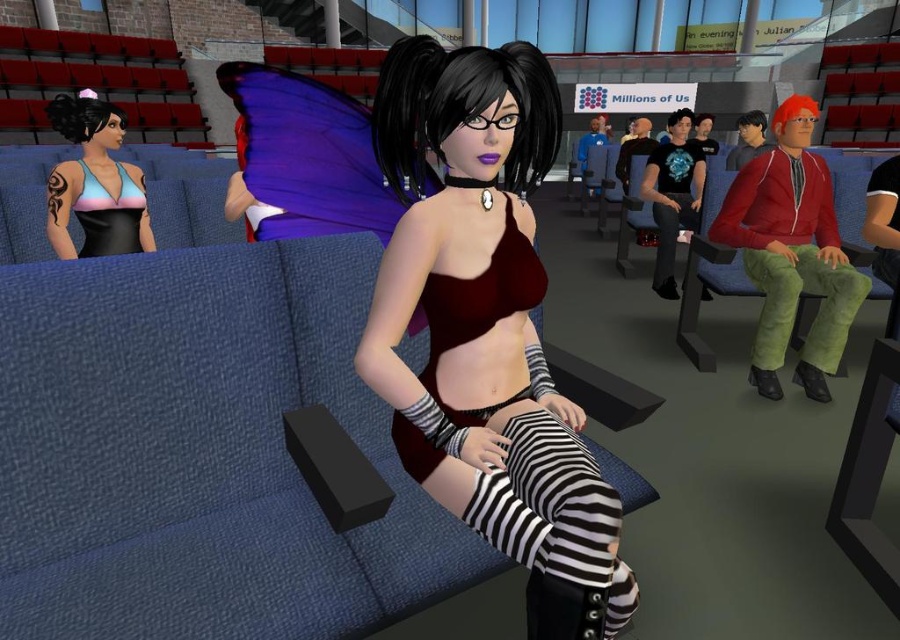
Question: Which of the following is the farthest from the observer?

Choices:
 (A) (657, 268)
 (B) (523, 268)
 (C) (774, 355)

Answer: (A)

Question: Is satin burgundy dress at center closer to camera compared to matte black bikini top at left?

Choices:
 (A) no
 (B) yes

Answer: (B)

Question: Can you confirm if matte black bikini top at left is positioned to the left of green fuzzy pants at right?

Choices:
 (A) yes
 (B) no

Answer: (A)

Question: Based on their relative distances, which object is farther from the green fuzzy pants at right?

Choices:
 (A) blue fabric couch at center
 (B) satin burgundy dress at center
 (C) pastel rainbow fabric dress at left

Answer: (C)

Question: Which is nearer to the black leather pants at center?

Choices:
 (A) pastel rainbow fabric dress at left
 (B) matte black bikini top at left
 (C) blue fabric couch at center

Answer: (A)

Question: Can you confirm if velvet maroon top at center is bigger than black leather pants at center?

Choices:
 (A) yes
 (B) no

Answer: (A)